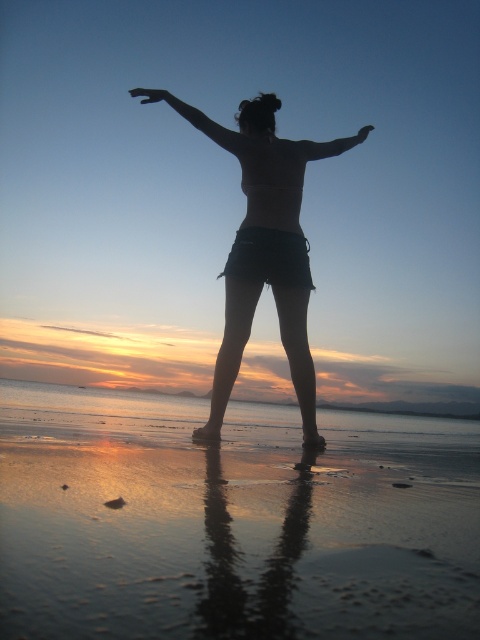
Is point (237, 138) positioned in front of point (343, 145)?

Yes.

Describe the element at coordinates (196, 120) in the screenshot. I see `black matte arm at upper center` at that location.

The image size is (480, 640). I want to click on black matte arm at upper center, so click(x=196, y=120).

Can you confirm if shiny wet sand at center is taller than black matte arm at upper center?

Yes, shiny wet sand at center is taller than black matte arm at upper center.

You are a GUI agent. You are given a task and a screenshot of the screen. Output one action in this format:
    pyautogui.click(x=<x>, y=<y>)
    Task: Click on the shiny wet sand at center
    This screenshot has width=480, height=640.
    Given the screenshot: What is the action you would take?
    pyautogui.click(x=231, y=520)

Between point (278, 138) and point (140, 93), which one is positioned in front?

Point (278, 138) is more forward.

Where is `black denim shorts at center`? This screenshot has width=480, height=640. black denim shorts at center is located at coordinates (261, 252).